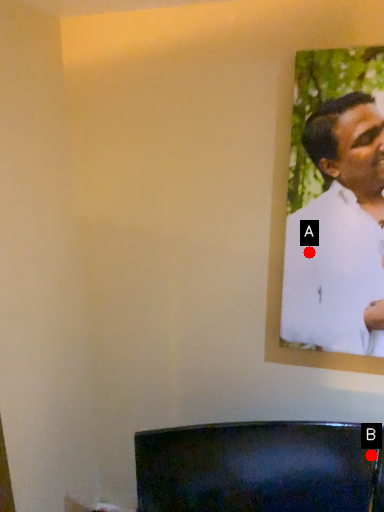
Question: Two points are circled on the image, labeled by A and B beside each circle. Which point is further to the camera?

Choices:
 (A) A is further
 (B) B is further

Answer: (B)